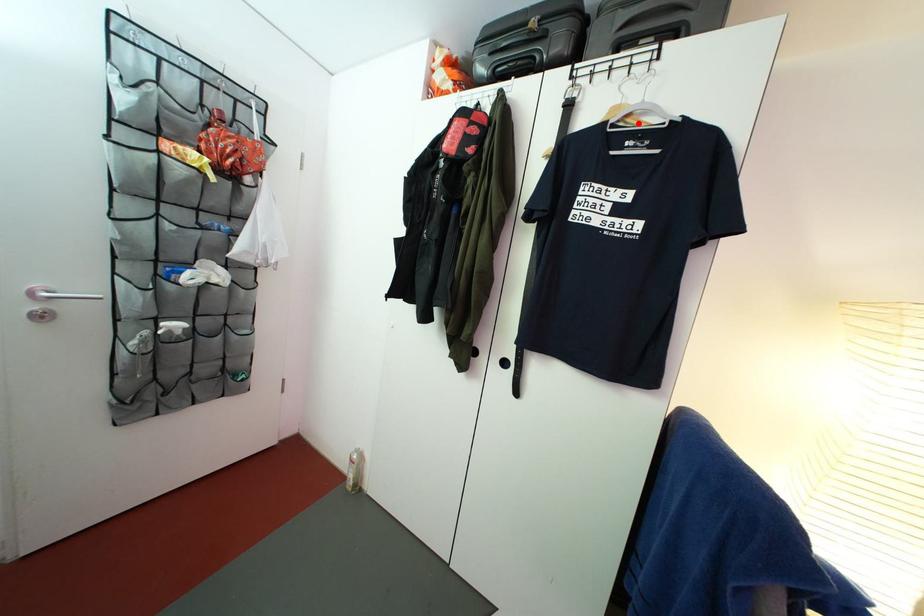
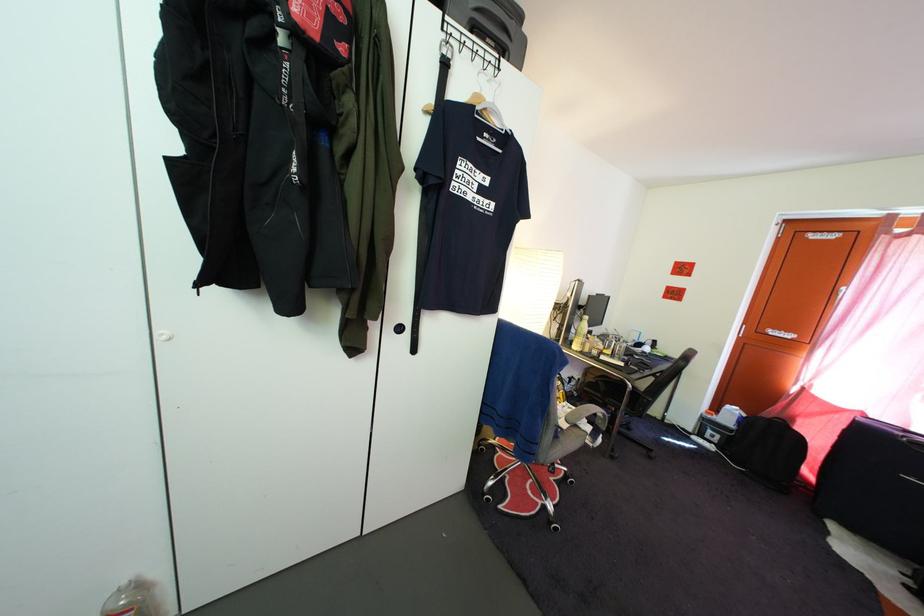
The point at the highlighted location is marked in the first image. Where is the corresponding point in the second image?

(494, 118)